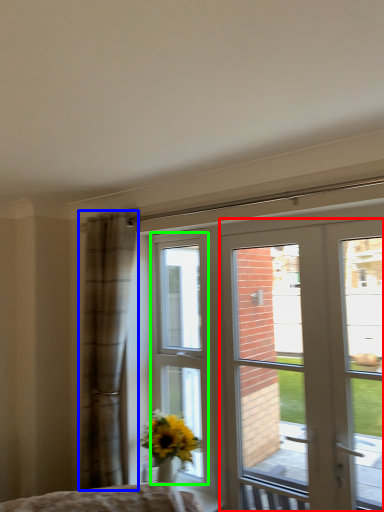
Question: Estimate the real-world distances between objects in this image. Which object is farther from door (highlighted by a red box), curtain (highlighted by a blue box) or bay window (highlighted by a green box)?

Choices:
 (A) curtain
 (B) bay window

Answer: (B)